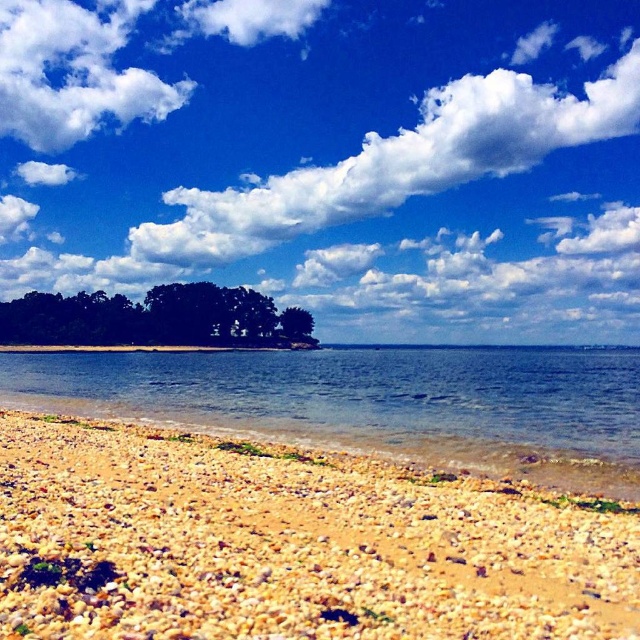
Is clear blue water at center positioned at the back of white fluffy cloud at upper center?

No, it is not.

Can you confirm if clear blue water at center is positioned to the right of white fluffy cloud at upper center?

No, clear blue water at center is not to the right of white fluffy cloud at upper center.

The height and width of the screenshot is (640, 640). What do you see at coordinates (364, 394) in the screenshot? I see `clear blue water at center` at bounding box center [364, 394].

Find the location of `clear blue water at center`. clear blue water at center is located at coordinates (364, 394).

Can you confirm if white fluffy cloud at upper center is shorter than green matte tree at center?

No.

Can you confirm if white fluffy cloud at upper center is positioned below green matte tree at center?

Incorrect, white fluffy cloud at upper center is not positioned below green matte tree at center.

Which is in front, point (205, 202) or point (289, 332)?

Point (289, 332) is more forward.

Find the location of a particular element. The image size is (640, 640). white fluffy cloud at upper center is located at coordinates (400, 163).

Is brown gravelly sand at lower left positioned behind green leafy trees at center?

No.

Is brown gravelly sand at lower left bigger than green leafy trees at center?

Actually, brown gravelly sand at lower left might be smaller than green leafy trees at center.

Is point (84, 634) less distant than point (310, 342)?

Yes.

At what (x,y) coordinates should I click in order to perform the action: click on brown gravelly sand at lower left. Please return your answer as a coordinate pair (x, y). Looking at the image, I should click on (291, 544).